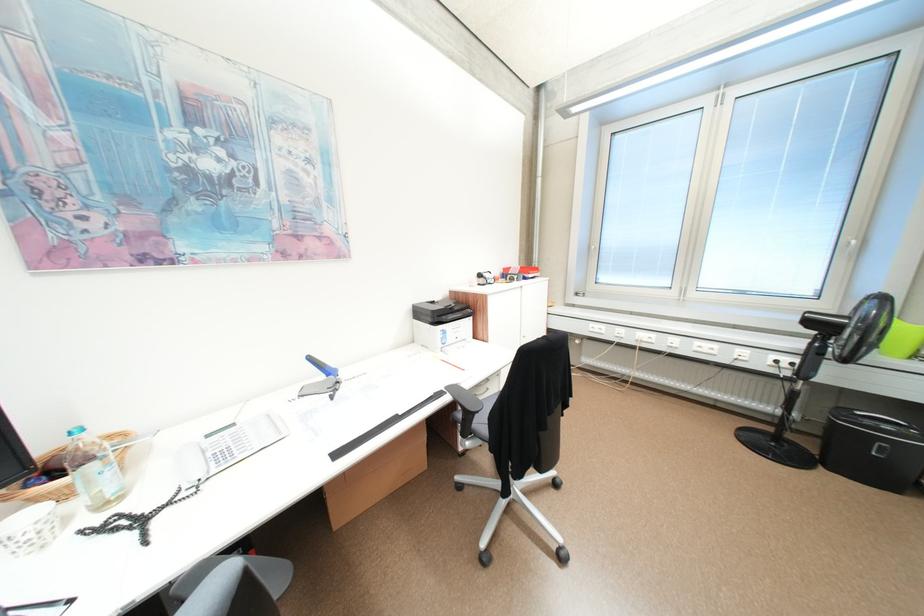
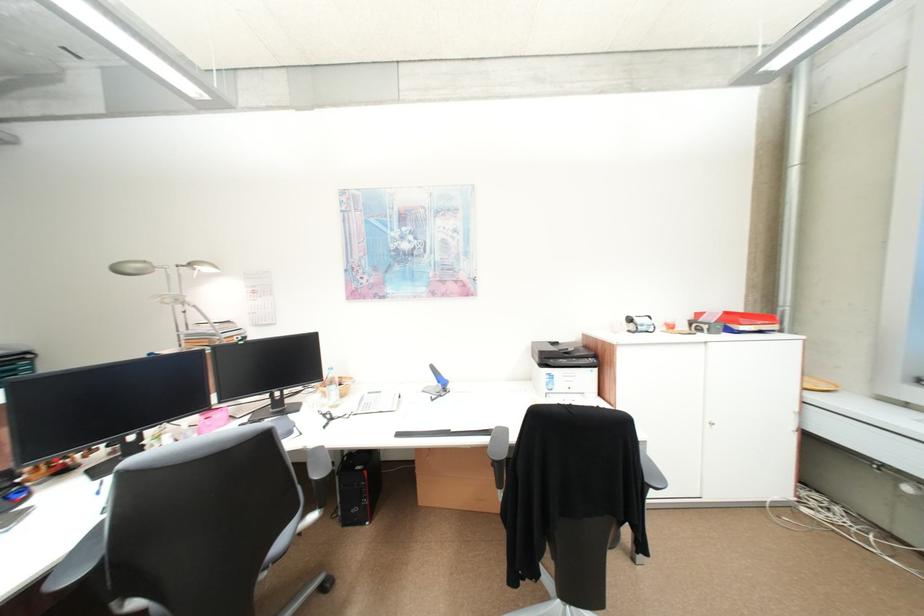
Find the pixel in the second image that matches pixel 443 312 in the first image.

(551, 353)